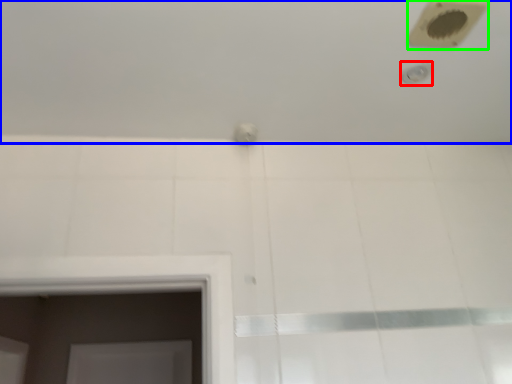
Question: Estimate the real-world distances between objects in this image. Which object is closer to shower (highlighted by a red box), bath (highlighted by a blue box) or hole (highlighted by a green box)?

Choices:
 (A) bath
 (B) hole

Answer: (B)